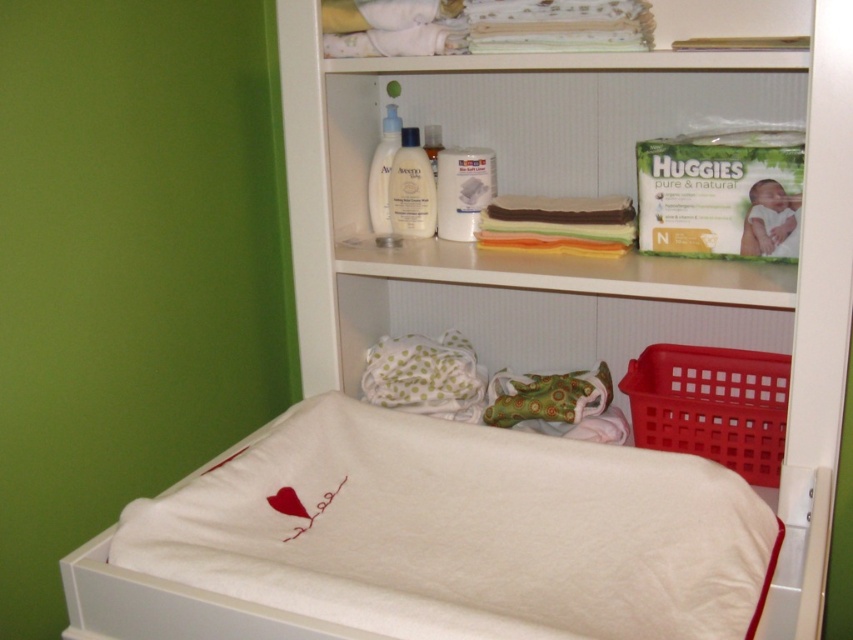
Question: Does white soft fabric infant bed at lower center have a smaller size compared to white plastic shelf at upper center?

Choices:
 (A) no
 (B) yes

Answer: (B)

Question: Is white soft fabric infant bed at lower center positioned at the back of white plastic shelf at upper center?

Choices:
 (A) yes
 (B) no

Answer: (B)

Question: Estimate the real-world distances between objects in this image. Which object is farther from the white cotton folded laundry at upper center?

Choices:
 (A) white soft fabric infant bed at lower center
 (B) white plastic shelf at upper center

Answer: (A)

Question: Which object is farther from the camera taking this photo?

Choices:
 (A) white soft fabric infant bed at lower center
 (B) red plastic basket at lower right
 (C) white cotton folded laundry at upper center

Answer: (B)

Question: Is red plastic basket at lower right bigger than white cotton folded laundry at upper center?

Choices:
 (A) yes
 (B) no

Answer: (A)

Question: Which object is positioned farthest from the white plastic shelf at upper center?

Choices:
 (A) white soft fabric infant bed at lower center
 (B) white cotton folded laundry at upper center

Answer: (A)